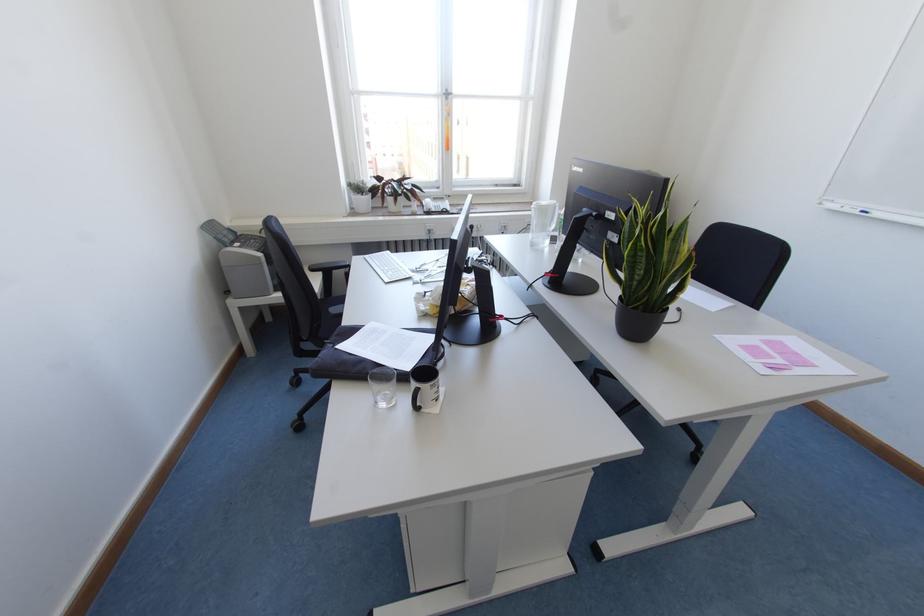
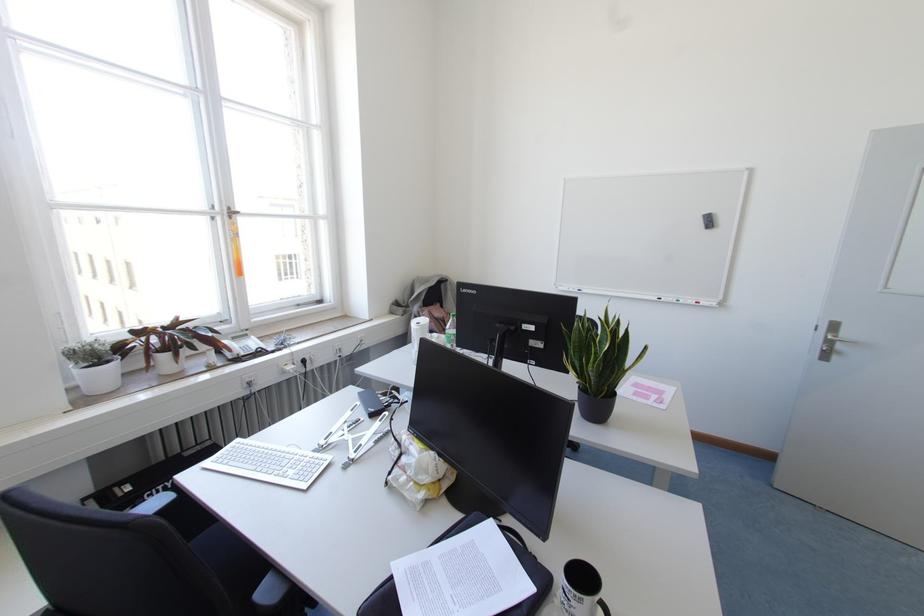
In the second image, find the point that corresponds to (444,209) in the first image.

(258, 349)